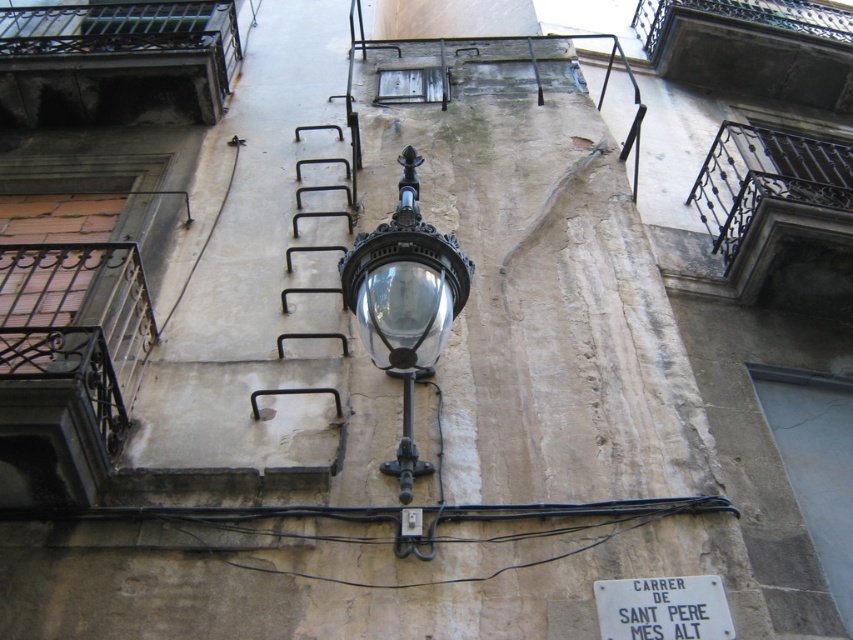
Is glossy glass lamp at upper center thinner than white matte sign at center?

Yes, glossy glass lamp at upper center is thinner than white matte sign at center.

Is point (410, 280) behind point (700, 579)?

No, (410, 280) is in front of (700, 579).

Does point (386, 340) come closer to viewer compared to point (625, 588)?

That is True.

Where is `glossy glass lamp at upper center`? This screenshot has width=853, height=640. glossy glass lamp at upper center is located at coordinates (405, 304).